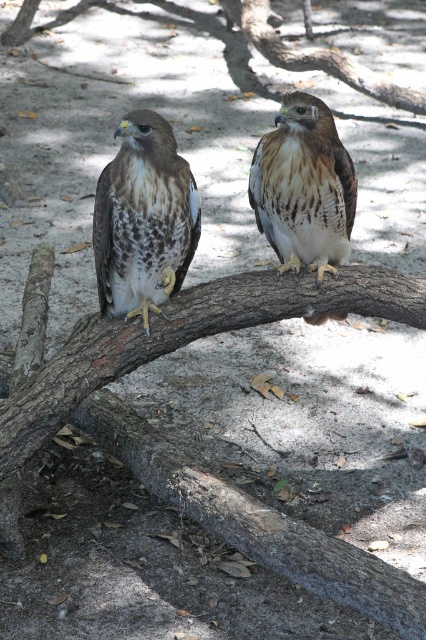
Question: Is brown speckled feathers at left below brown speckled feathers at center?

Choices:
 (A) yes
 (B) no

Answer: (A)

Question: Does brown speckled feathers at left come behind brown speckled feathers at center?

Choices:
 (A) yes
 (B) no

Answer: (B)

Question: Which object is farther from the camera taking this photo?

Choices:
 (A) brown speckled feathers at center
 (B) brown speckled feathers at left

Answer: (A)

Question: Which object appears farthest from the camera in this image?

Choices:
 (A) brown speckled feathers at left
 (B) brown speckled feathers at center

Answer: (B)

Question: Does brown speckled feathers at left have a greater width compared to brown speckled feathers at center?

Choices:
 (A) no
 (B) yes

Answer: (A)